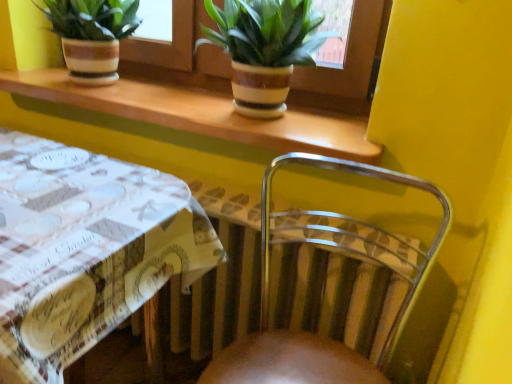
This screenshot has height=384, width=512. Identify the location of free point to the left of green leafy plant in striped pot at upper center, acting as the second houseplant starting from the left. (166, 98).